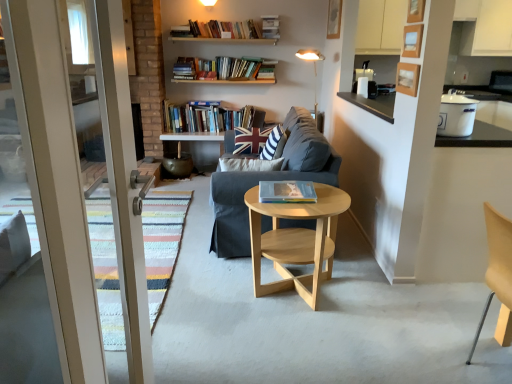
This screenshot has height=384, width=512. What do you see at coordinates (274, 144) in the screenshot?
I see `striped fabric pillow at center, marked as the 1th pillow in a front-to-back arrangement` at bounding box center [274, 144].

Locate an element on the screen. Image resolution: width=512 pixels, height=384 pixels. hardcover books at upper center, positioned as the second book in right-to-left order is located at coordinates (209, 118).

The image size is (512, 384). What do you see at coordinates (255, 140) in the screenshot?
I see `union jack fabric pillow at center, the second pillow in the front-to-back sequence` at bounding box center [255, 140].

The width and height of the screenshot is (512, 384). Describe the element at coordinates (269, 180) in the screenshot. I see `dark gray fabric couch at center` at that location.

This screenshot has height=384, width=512. Find the location of `white fabric lampshade at upper center`. white fabric lampshade at upper center is located at coordinates pyautogui.click(x=314, y=71).

Locate an element on the screen. This screenshot has height=384, width=512. white enamel pot at upper right is located at coordinates (456, 115).

At what (x,y) coordinates should I click in order to perform the action: click on light wood/woodenobject at center. Please return your answer as a coordinate pair (x, y). The height and width of the screenshot is (384, 512). Looking at the image, I should click on (296, 240).

Where is `striped fabric pillow at center, marked as the 1th pillow in a front-to-back arrangement`? This screenshot has width=512, height=384. striped fabric pillow at center, marked as the 1th pillow in a front-to-back arrangement is located at coordinates (274, 144).

Looking at this image, which of these two, light wood/woodenobject at center or hardcover books at upper center, positioned as the second book in right-to-left order, is thinner?

hardcover books at upper center, positioned as the second book in right-to-left order.

Is light wood/woodenobject at center far from hardcover books at upper center, the first book in the back-to-front sequence?

Yes, light wood/woodenobject at center is far from hardcover books at upper center, the first book in the back-to-front sequence.

Which object is further away from the camera, light wood/woodenobject at center or hardcover books at upper center, the 1th book when ordered from left to right?

hardcover books at upper center, the 1th book when ordered from left to right, is more distant.

Which object is closer to the camera taking this photo, white fabric lampshade at upper center or dark gray fabric couch at center?

dark gray fabric couch at center is in front.

I want to click on light fixture above the dark gray fabric couch at center (from a real-world perspective), so click(314, 71).

Considering the relative sizes of white fabric lampshade at upper center and dark gray fabric couch at center in the image provided, is white fabric lampshade at upper center smaller than dark gray fabric couch at center?

Indeed, white fabric lampshade at upper center has a smaller size compared to dark gray fabric couch at center.

Can you confirm if white fabric lampshade at upper center is thinner than dark gray fabric couch at center?

Yes.

The width and height of the screenshot is (512, 384). I want to click on the 1st book directly beneath the white enamel pot at upper right (from a real-world perspective), so click(x=209, y=118).

Between white enamel pot at upper right and hardcover books at upper center, the 2th book viewed from the front, which one has smaller width?

Thinner between the two is white enamel pot at upper right.

From the picture: From a real-world perspective, is white enamel pot at upper right positioned over hardcover books at upper center, the first book in the back-to-front sequence, based on gravity?

Indeed, from a real-world perspective, white enamel pot at upper right stands above hardcover books at upper center, the first book in the back-to-front sequence.

Where is `light fixture located on the right of hardcover books at upper center, the 1th book when ordered from left to right`? The image size is (512, 384). light fixture located on the right of hardcover books at upper center, the 1th book when ordered from left to right is located at coordinates (314, 71).

Is hardcover books at upper center, placed as the 2th book when sorted from bottom to top, next to white fabric lampshade at upper center?

They are not placed beside each other.

Does hardcover books at upper center, the 2th book viewed from the front, have a larger size compared to white fabric lampshade at upper center?

Indeed, hardcover books at upper center, the 2th book viewed from the front, has a larger size compared to white fabric lampshade at upper center.

Is point (227, 110) closer or farther from the camera than point (316, 108)?

Point (227, 110) is closer to the camera than point (316, 108).

Considering the sizes of objects striped fabric pillow at center, which is the second pillow in back-to-front order, and hardcover book at center, positioned as the 2th book in back-to-front order, in the image provided, who is bigger, striped fabric pillow at center, which is the second pillow in back-to-front order, or hardcover book at center, positioned as the 2th book in back-to-front order,?

With larger size is striped fabric pillow at center, which is the second pillow in back-to-front order.

Would you say striped fabric pillow at center, marked as the 1th pillow in a front-to-back arrangement, is to the left or to the right of hardcover book at center, positioned as the 2th book in back-to-front order, in the picture?

striped fabric pillow at center, marked as the 1th pillow in a front-to-back arrangement, is positioned on hardcover book at center, positioned as the 2th book in back-to-front order,'s left side.

From the picture: Is striped fabric pillow at center, which is the second pillow in back-to-front order, looking in the opposite direction of hardcover book at center, placed as the 2th book when sorted from top to bottom?

No, striped fabric pillow at center, which is the second pillow in back-to-front order,'s orientation is not away from hardcover book at center, placed as the 2th book when sorted from top to bottom.

Considering the relative sizes of striped fabric pillow at center, marked as the 1th pillow in a front-to-back arrangement, and hardcover book at center, positioned as the 2th book in back-to-front order, in the image provided, is striped fabric pillow at center, marked as the 1th pillow in a front-to-back arrangement, thinner than hardcover book at center, positioned as the 2th book in back-to-front order,?

Correct, the width of striped fabric pillow at center, marked as the 1th pillow in a front-to-back arrangement, is less than that of hardcover book at center, positioned as the 2th book in back-to-front order.

Does hardcover book at center, placed as the 2th book when sorted from top to bottom, have a lesser height compared to white fabric lampshade at upper center?

Correct, hardcover book at center, placed as the 2th book when sorted from top to bottom, is not as tall as white fabric lampshade at upper center.

Is hardcover book at center, placed as the 2th book when sorted from top to bottom, to the left of white fabric lampshade at upper center from the viewer's perspective?

Yes.

How far apart are hardcover book at center, which ranks as the 1th book in bottom-to-top order, and white fabric lampshade at upper center?

They are 2.60 meters apart.

From a real-world perspective, is light wood/woodenobject at center beneath white enamel pot at upper right?

Indeed, from a real-world perspective, light wood/woodenobject at center is positioned beneath white enamel pot at upper right.

Would you say light wood/woodenobject at center contains white enamel pot at upper right?

Definitely not — white enamel pot at upper right is not inside light wood/woodenobject at center.

Does light wood/woodenobject at center turn towards white enamel pot at upper right?

No, light wood/woodenobject at center does not turn towards white enamel pot at upper right.

Locate an element on the screen. The height and width of the screenshot is (384, 512). coffee table below the hardcover books at upper center, positioned as the second book in right-to-left order (from the image's perspective) is located at coordinates (296, 240).

This screenshot has width=512, height=384. In order to click on light fixture above the dark gray fabric couch at center (from a real-world perspective) in this screenshot , I will do `click(314, 71)`.

When comparing their distances from light wood/woodenobject at center, does union jack fabric pillow at center, the second pillow in the front-to-back sequence, or striped fabric pillow at center, which is the second pillow in back-to-front order, seem closer?

striped fabric pillow at center, which is the second pillow in back-to-front order, is positioned closer to the anchor light wood/woodenobject at center.

Considering their positions, is dark gray fabric couch at center positioned closer to union jack fabric pillow at center, the second pillow in the front-to-back sequence, than hardcover book at center, which appears as the first book when viewed from the front?

The object closer to union jack fabric pillow at center, the second pillow in the front-to-back sequence, is dark gray fabric couch at center.

Based on their spatial positions, is striped fabric pillow at center, which is the second pillow in back-to-front order, or white enamel pot at upper right further from light wood/woodenobject at center?

white enamel pot at upper right is positioned further to the anchor light wood/woodenobject at center.

When comparing their distances from hardcover books at upper center, the first book in the back-to-front sequence, does white fabric lampshade at upper center or dark gray fabric couch at center seem closer?

white fabric lampshade at upper center lies closer to hardcover books at upper center, the first book in the back-to-front sequence, than the other object.

When comparing their distances from striped fabric pillow at center, which is the second pillow in back-to-front order, does hardcover books at upper center, the 2th book viewed from the front, or white enamel pot at upper right seem further?

Among the two, hardcover books at upper center, the 2th book viewed from the front, is located further to striped fabric pillow at center, which is the second pillow in back-to-front order.

From the image, which object appears to be nearer to dark gray fabric couch at center, union jack fabric pillow at center, the second pillow in the front-to-back sequence, or hardcover book at center, which appears as the first book when viewed from the front?

union jack fabric pillow at center, the second pillow in the front-to-back sequence.

Looking at the image, which one is located closer to union jack fabric pillow at center, positioned as the first pillow in back-to-front order, white enamel pot at upper right or hardcover book at center, which is the 1th book from right to left?

Based on the image, hardcover book at center, which is the 1th book from right to left, appears to be nearer to union jack fabric pillow at center, positioned as the first pillow in back-to-front order.

Based on their spatial positions, is hardcover books at upper center, the first book in the back-to-front sequence, or hardcover book at center, which ranks as the 1th book in bottom-to-top order, further from striped fabric pillow at center, marked as the 1th pillow in a front-to-back arrangement?

hardcover books at upper center, the first book in the back-to-front sequence, is further to striped fabric pillow at center, marked as the 1th pillow in a front-to-back arrangement.

Find the location of a particular element. The image size is (512, 384). appliance between light wood/woodenobject at center and hardcover books at upper center, the 2th book viewed from the front, from front to back is located at coordinates (456, 115).

The image size is (512, 384). In order to click on studio couch between hardcover book at center, which appears as the first book when viewed from the front, and union jack fabric pillow at center, positioned as the first pillow in back-to-front order, along the z-axis in this screenshot , I will do coord(269,180).

Identify the location of pillow positioned between white enamel pot at upper right and union jack fabric pillow at center, the second pillow in the front-to-back sequence, from near to far. (274, 144).

The width and height of the screenshot is (512, 384). I want to click on light fixture positioned between dark gray fabric couch at center and hardcover books at upper center, positioned as the second book in right-to-left order, from near to far, so click(314, 71).